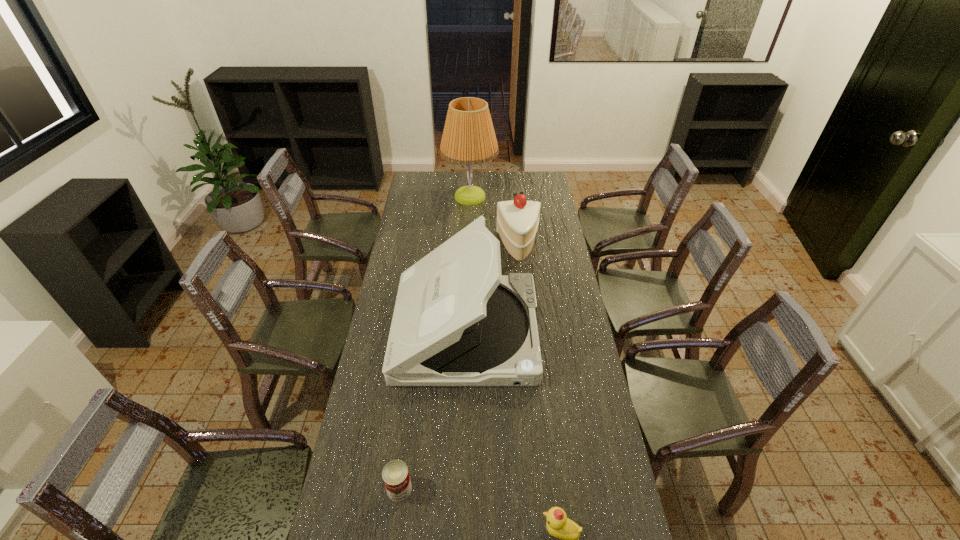
Locate an element on the screen. Image resolution: width=960 pixels, height=540 pixels. free location located 0.070m on the front label of the second nearest object is located at coordinates (395, 529).

This screenshot has width=960, height=540. I want to click on object that is at the far edge, so click(x=468, y=138).

Locate an element on the screen. The image size is (960, 540). CD player situated at the left edge is located at coordinates (457, 321).

Find the location of a particular element. Image resolution: width=960 pixels, height=540 pixels. can at the left edge is located at coordinates (395, 474).

The image size is (960, 540). Identify the location of object located in the right edge section of the desktop. (517, 221).

Find the location of a particular element. The image size is (960, 540). vacant region at the far edge of the desktop is located at coordinates (481, 186).

The width and height of the screenshot is (960, 540). I want to click on free space at the left edge of the desktop, so click(x=372, y=419).

At what (x,y) coordinates should I click in order to perform the action: click on vacant space at the right edge. Please return your answer as a coordinate pair (x, y). The width and height of the screenshot is (960, 540). Looking at the image, I should click on (564, 248).

I want to click on vacant area at the far left corner, so click(x=428, y=178).

Where is `free point between the farthest object and the cake`? The width and height of the screenshot is (960, 540). free point between the farthest object and the cake is located at coordinates (494, 221).